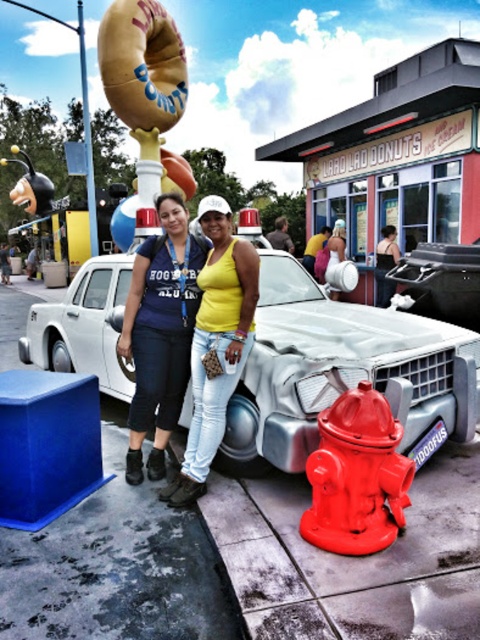
Question: Can you confirm if shiny red fire hydrant at lower right is thinner than matte yellow donut at upper left?

Choices:
 (A) no
 (B) yes

Answer: (A)

Question: Which point is farther to the camera?

Choices:
 (A) matte yellow donut at upper left
 (B) smooth leather jacket at center
 (C) matte blue shirt at center

Answer: (B)

Question: Is metallic silver car at center above matte yellow donut at upper left?

Choices:
 (A) yes
 (B) no

Answer: (B)

Question: Which object appears closest to the camera in this image?

Choices:
 (A) metallic silver car at center
 (B) smooth leather jacket at center
 (C) matte blue shirt at center
 (D) shiny red fire hydrant at lower right

Answer: (D)

Question: Which of the following is the closest to the observer?

Choices:
 (A) [108, 52]
 (B) [322, 244]
 (C) [175, 392]
 (D) [287, 250]

Answer: (C)

Question: Can you confirm if matte yellow donut at upper left is positioned below yellow fabric shirt at center?

Choices:
 (A) no
 (B) yes

Answer: (A)